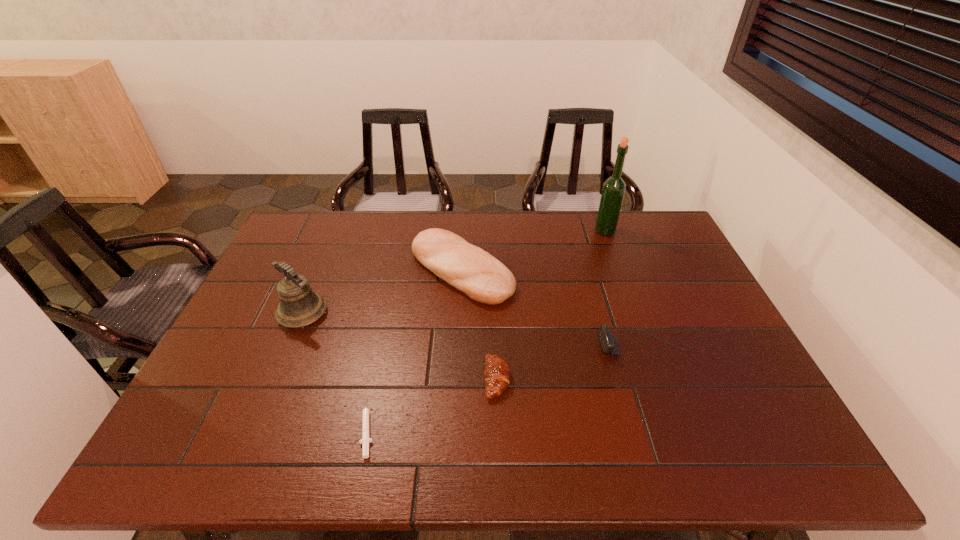
Where is `liquor`? liquor is located at coordinates (614, 187).

Identify the location of the farthest object. The width and height of the screenshot is (960, 540). (614, 187).

This screenshot has width=960, height=540. What are the coordinates of `the leftmost object` in the screenshot? It's located at click(299, 306).

In order to click on bell in this screenshot , I will do `click(299, 306)`.

This screenshot has width=960, height=540. I want to click on the fourth shortest object, so click(470, 269).

Identify the location of the third shortest object. (608, 341).

You are a GUI agent. You are given a task and a screenshot of the screen. Output one action in this format:
    pyautogui.click(x=<x>, y=<y>)
    Task: Click on the crescent roll
    Image resolution: width=960 pixels, height=540 pixels.
    Given the screenshot: What is the action you would take?
    pyautogui.click(x=497, y=374)

This screenshot has height=540, width=960. Identify the location of the second object from left to right. (365, 440).

This screenshot has height=540, width=960. In order to click on syringe in this screenshot , I will do `click(365, 440)`.

This screenshot has width=960, height=540. Find the location of `vacant space located 0.160m on the left of the farthest object`. vacant space located 0.160m on the left of the farthest object is located at coordinates (549, 231).